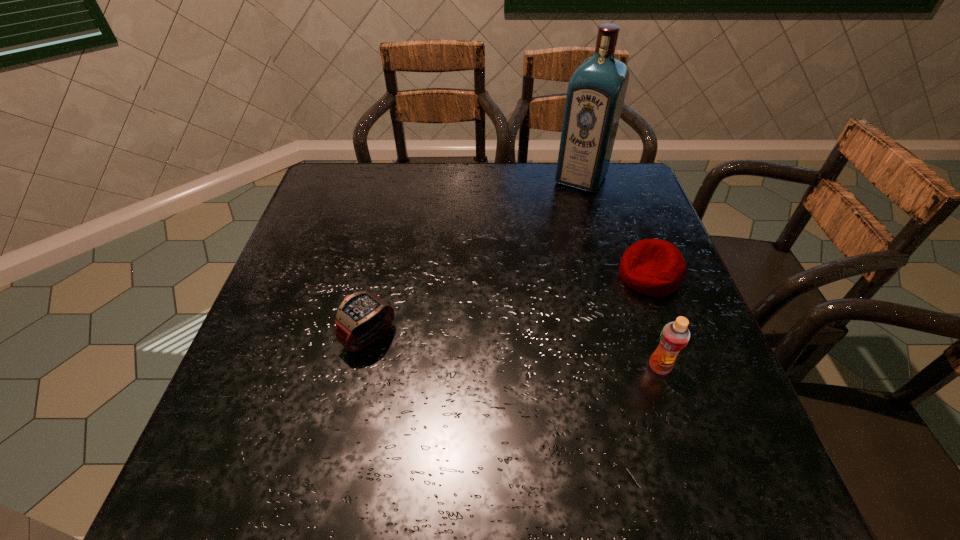
Image resolution: width=960 pixels, height=540 pixels. I want to click on free space located on the seat area of the second farthest object, so click(x=579, y=305).

Where is `vacant space located 0.280m on the seat area of the second farthest object`? This screenshot has width=960, height=540. vacant space located 0.280m on the seat area of the second farthest object is located at coordinates (521, 330).

Where is `free space located 0.220m on the flat label side of the farthest object`? free space located 0.220m on the flat label side of the farthest object is located at coordinates (544, 238).

Image resolution: width=960 pixels, height=540 pixels. In order to click on free space located 0.140m on the flat label side of the farthest object in this screenshot , I will do `click(556, 220)`.

This screenshot has height=540, width=960. I want to click on blank space located 0.090m on the flat label side of the farthest object, so click(562, 211).

Locate an element on the screen. This screenshot has height=540, width=960. object that is at the far edge is located at coordinates (596, 92).

Where is `orange juice located at the right edge`? Image resolution: width=960 pixels, height=540 pixels. orange juice located at the right edge is located at coordinates (674, 337).

You are a GUI agent. You are given a task and a screenshot of the screen. Output one action in this format:
    pyautogui.click(x=<x>, y=<y>)
    Task: Click on the beanbag at the right edge
    
    Given the screenshot: What is the action you would take?
    pyautogui.click(x=653, y=267)

You are a GUI agent. You are given a task and a screenshot of the screen. Output one action in this format:
    pyautogui.click(x=<x>, y=<y>)
    Task: Click on the liquor present at the right edge
    Image resolution: width=960 pixels, height=540 pixels.
    Given the screenshot: What is the action you would take?
    pyautogui.click(x=596, y=92)

Identify the location of object present at the far right corner. This screenshot has height=540, width=960. (596, 92).